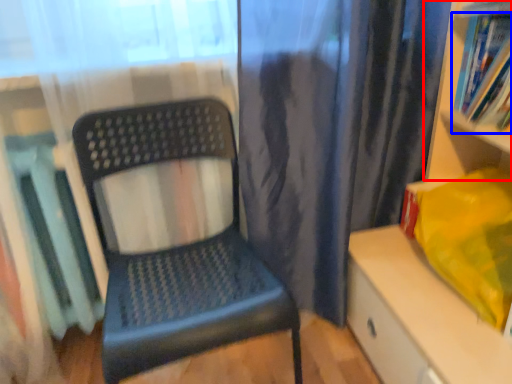
Question: Which point is closer to the camera, shelf (highlighted by a red box) or book (highlighted by a blue box)?

Choices:
 (A) shelf
 (B) book

Answer: (A)